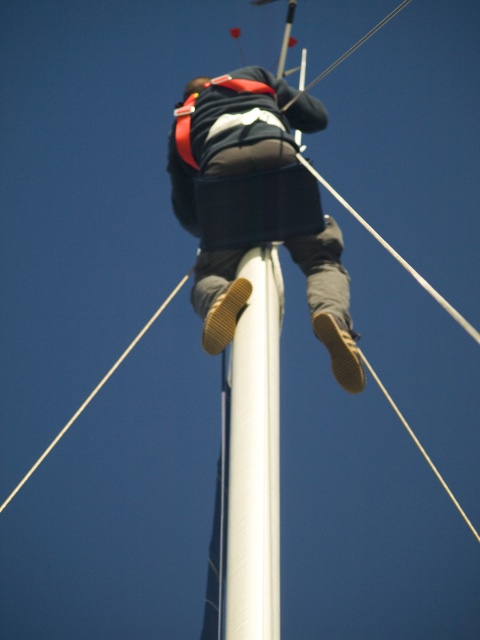
Question: Does matte black jacket at center have a lesser width compared to white smooth pole at center?

Choices:
 (A) yes
 (B) no

Answer: (B)

Question: Which point is closer to the camera?

Choices:
 (A) (238, 515)
 (B) (297, 106)

Answer: (A)

Question: Which object is farther from the camera taking this photo?

Choices:
 (A) white smooth pole at center
 (B) matte black jacket at center

Answer: (B)

Question: Can you confirm if matte black jacket at center is positioned to the left of white smooth pole at center?

Choices:
 (A) yes
 (B) no

Answer: (A)

Question: Does matte black jacket at center appear on the right side of white smooth pole at center?

Choices:
 (A) yes
 (B) no

Answer: (B)